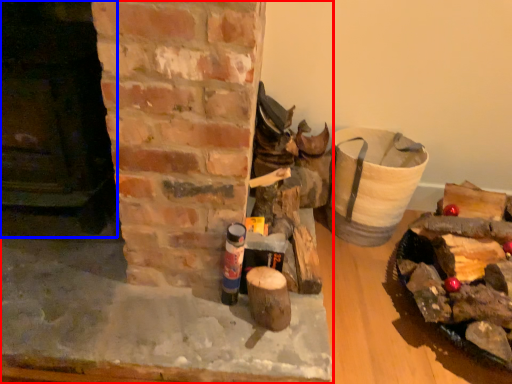
Question: Which object is further to the camera taking this photo, fireplace (highlighted by a red box) or fireplace (highlighted by a blue box)?

Choices:
 (A) fireplace
 (B) fireplace

Answer: (A)